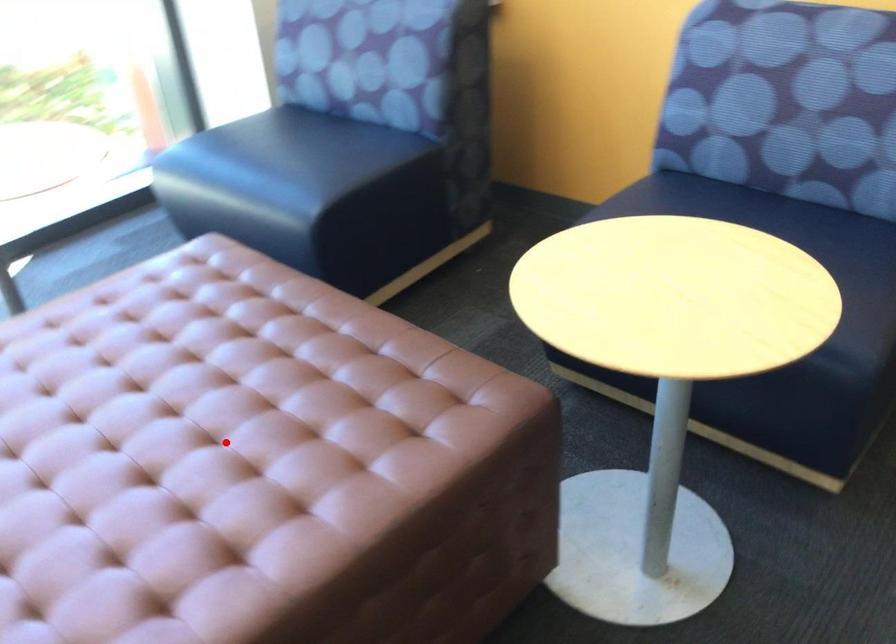
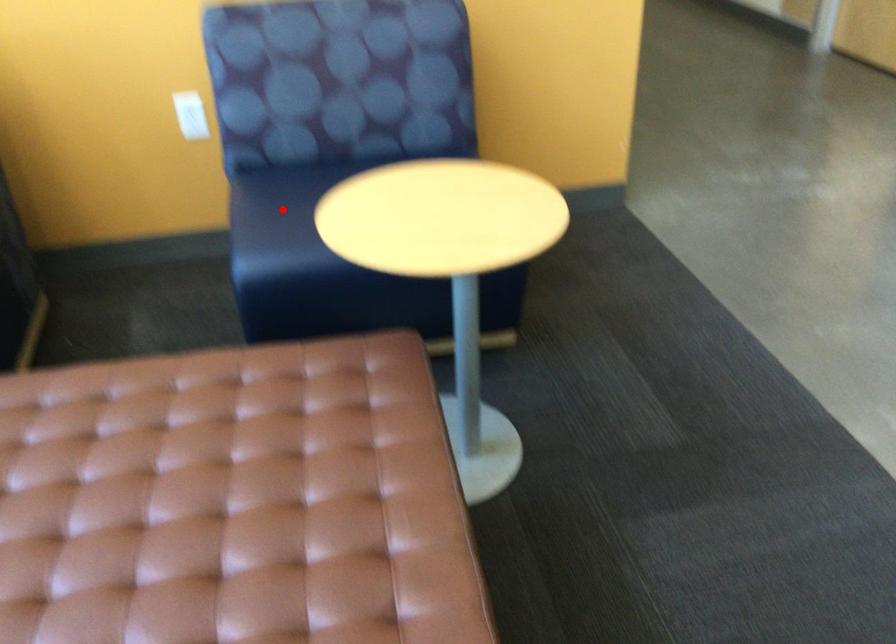
I am providing you with two images of the same scene from different viewpoints. A red point is marked on the first image and another point is marked on the second image. Does the point marked in image1 correspond to the same location as the one in image2?

No